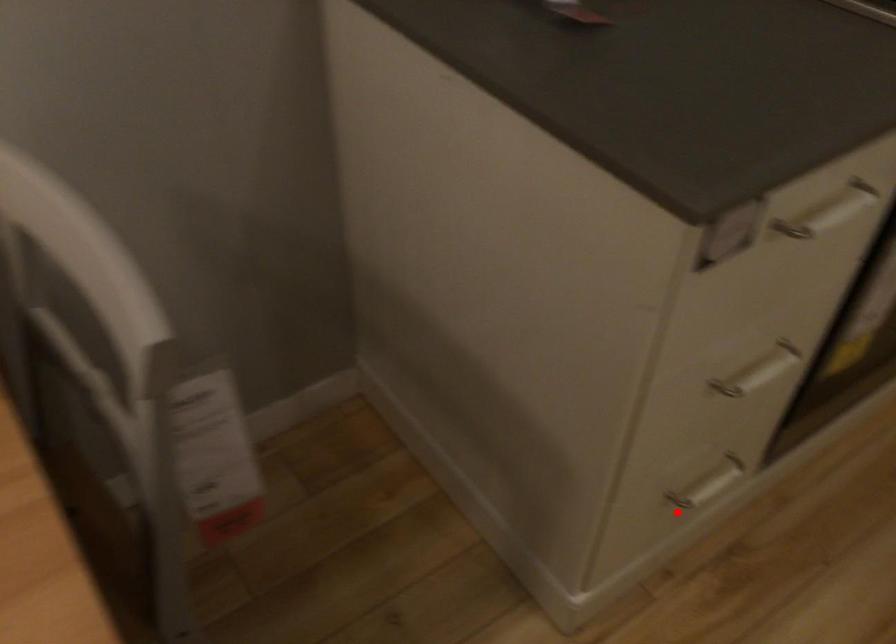
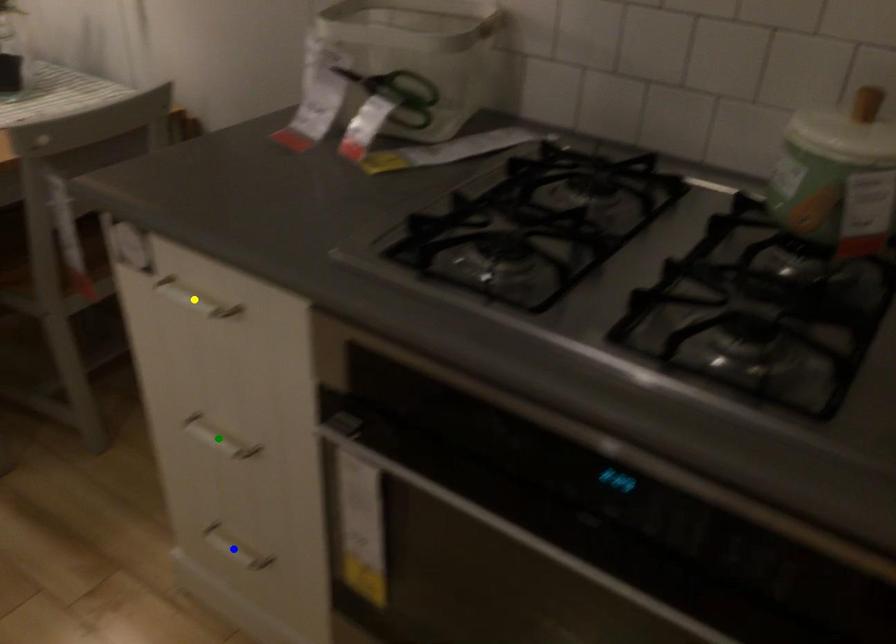
Question: I am providing you with two images of the same scene from different viewpoints. A red point is marked on the first image. You are given multiple points on the second image. Which spot in image 2 lines up with the point in image 1?

Choices:
 (A) green point
 (B) yellow point
 (C) blue point

Answer: (C)